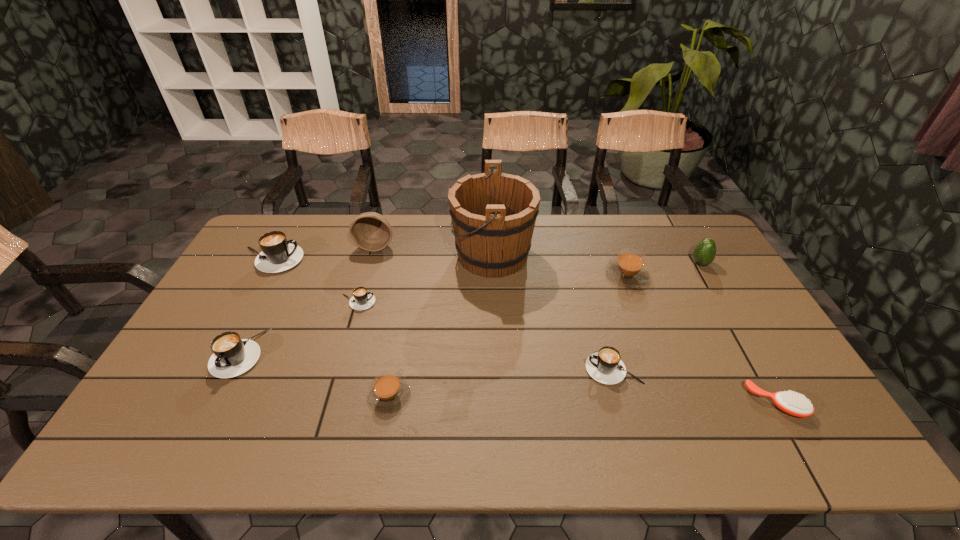
Where is `the fourth closest object to the third smallest black cappuccino`? This screenshot has width=960, height=540. the fourth closest object to the third smallest black cappuccino is located at coordinates (371, 231).

Identify the location of cappuccino that can be found as the fourth closest to the second biggest black cappuccino. (605, 366).

Where is `cappuccino that is the closest to the wine bucket`? This screenshot has height=540, width=960. cappuccino that is the closest to the wine bucket is located at coordinates (628, 270).

Choose which black cappuccino is the nearest neighbor to the second tallest object. Please provide its 2D coordinates. Your answer should be formatted as a tuple, i.e. [(x, y)], where the tuple contains the x and y coordinates of a point satisfying the conditions above.

[(278, 254)]

Identify which black cappuccino is the third closest to the nearer brown cappuccino. Please provide its 2D coordinates. Your answer should be formatted as a tuple, i.e. [(x, y)], where the tuple contains the x and y coordinates of a point satisfying the conditions above.

[(605, 366)]

At what (x,y) coordinates should I click in order to perform the action: click on vacant region that satisfies the following two spatial constraints: 1. with the handle on the side of the third smallest black cappuccino; 2. on the right side of the orange hairbrush. Please return your answer as a coordinate pair (x, y). This screenshot has width=960, height=540. Looking at the image, I should click on (214, 403).

Find the location of a particular element. The image size is (960, 540). blank area in the image that satisfies the following two spatial constraints: 1. on the back side of the fifth object from left to right; 2. on the left side of the farther brown cappuccino is located at coordinates (411, 275).

This screenshot has width=960, height=540. What are the coordinates of `free space that satisfies the following two spatial constraints: 1. with the handle on the side of the second smallest black cappuccino; 2. on the right side of the orange hairbrush` in the screenshot? It's located at (622, 403).

The width and height of the screenshot is (960, 540). In order to click on vacant area in the image that satisfies the following two spatial constraints: 1. on the back side of the right brown cappuccino; 2. on the side of the sixth object from left to right with the handle for carrying in this screenshot , I will do `click(619, 255)`.